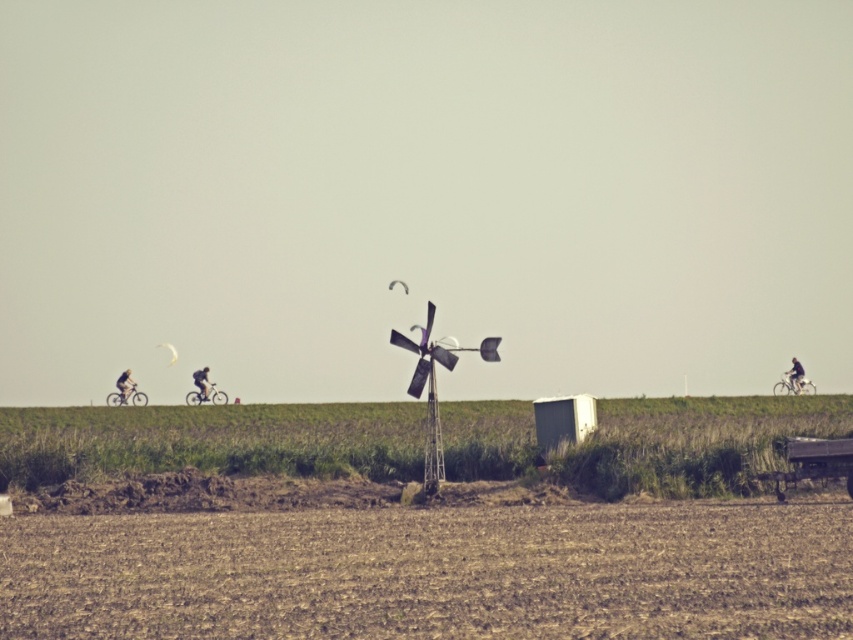
You are a cyclist approaching the dark gray bicycle at left and the dark blue fabric cyclist at upper center in the scene. Which object is positioned more to the left?

The dark gray bicycle at left is positioned more to the left than the dark blue fabric cyclist at upper center.

You are standing in a rural landscape with a plowed field and a windmill. You see the brown soil at center and the dark blue fabric cyclist at upper center. Which object is closer to you?

The brown soil at center is closer to you because it is in front of the dark blue fabric cyclist at upper center.

You are a farmer standing in the middle of the plowed field and see the metallic windmill at center and the dark gray fabric bicycle at center. Which object is closer to you?

The metallic windmill at center is closer to you because it is in front of the dark gray fabric bicycle at center.